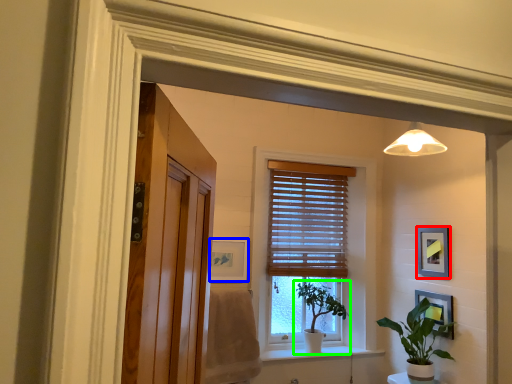
Question: Considering the real-world distances, which object is farthest from picture frame (highlighted by a red box)? picture frame (highlighted by a blue box) or houseplant (highlighted by a green box)?

Choices:
 (A) picture frame
 (B) houseplant

Answer: (A)